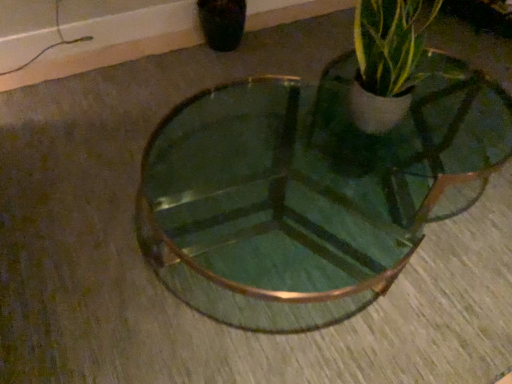
Locate an element on the screen. free location to the left of transparent glass table at center is located at coordinates (x=103, y=193).